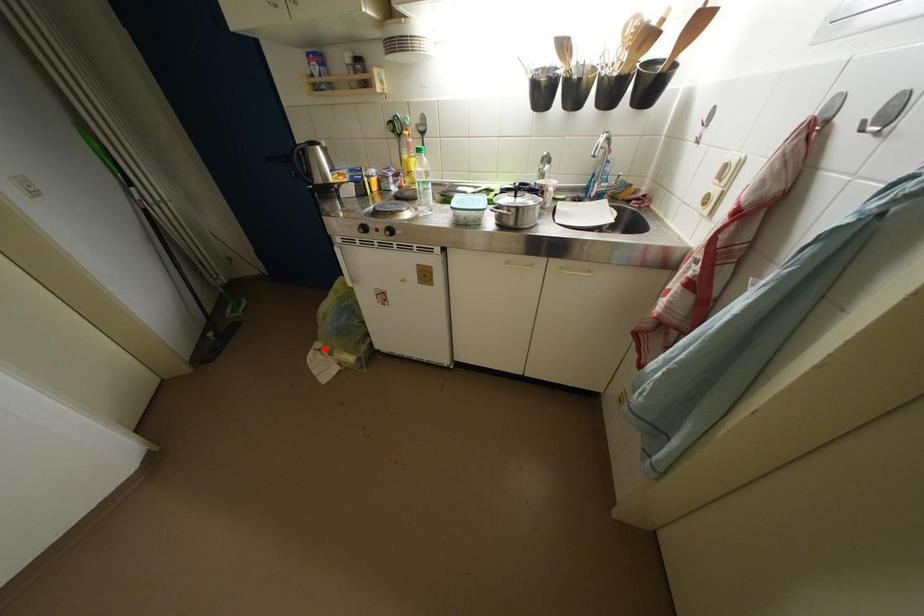
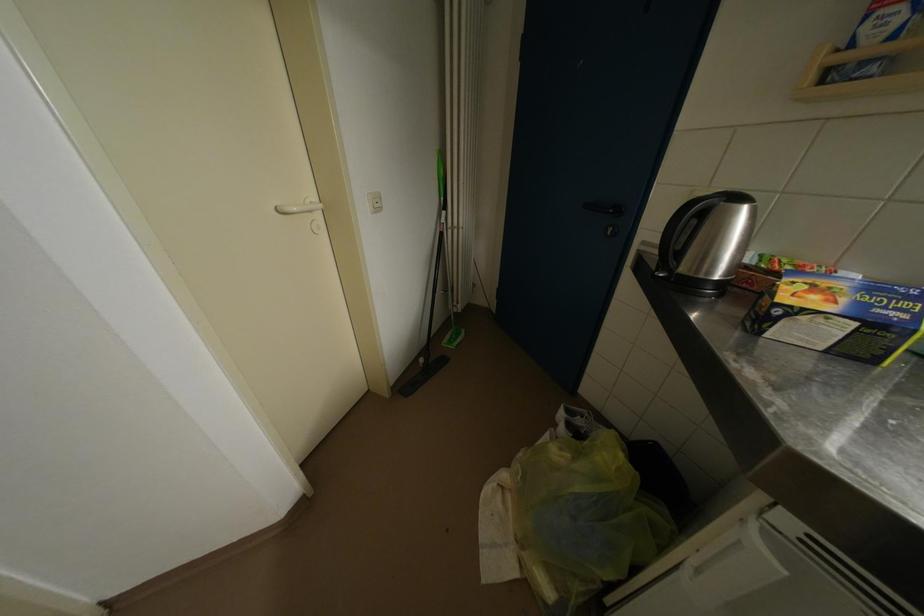
Question: A red point is marked in image1. In image2, is the corresponding 3D point closer to the camera or farther? Reply with the corresponding letter.

Choices:
 (A) The corresponding 3D point is closer.
 (B) The corresponding 3D point is farther.

Answer: (A)